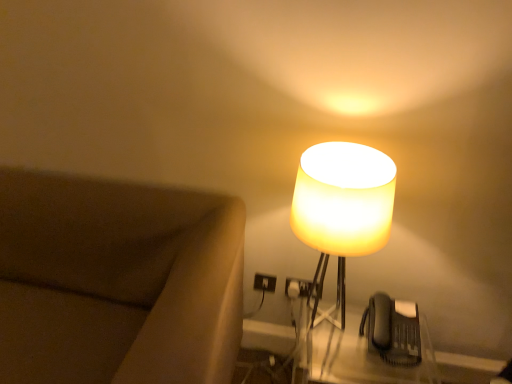
Image resolution: width=512 pixels, height=384 pixels. I want to click on brown fabric couch at left, so click(117, 282).

Where is `translucent plastic table at lower right`? translucent plastic table at lower right is located at coordinates (372, 352).

What's the angular difference between translucent plastic table at lower right and translucent yellow glass lampshade at right's facing directions?

The angular difference between translucent plastic table at lower right and translucent yellow glass lampshade at right is 3.89 degrees.

From a real-world perspective, between translucent plastic table at lower right and translucent yellow glass lampshade at right, who is vertically higher?

From a 3D spatial view, translucent yellow glass lampshade at right is above.

Considering the relative positions of translucent plastic table at lower right and translucent yellow glass lampshade at right in the image provided, is translucent plastic table at lower right in front of translucent yellow glass lampshade at right?

No, it is behind translucent yellow glass lampshade at right.

Is brown fabric couch at left looking in the opposite direction of translucent plastic table at lower right?

No, translucent plastic table at lower right is not at the back of brown fabric couch at left.

What are the coordinates of `table below the brown fabric couch at left (from the image's perspective)` in the screenshot? It's located at (372, 352).

Which object is further away from the camera taking this photo, brown fabric couch at left or translucent plastic table at lower right?

translucent plastic table at lower right.

Identify the location of table in front of the black plastic phone at lower right. (372, 352).

Can translucent plastic table at lower right be found inside black plastic phone at lower right?

That's incorrect, translucent plastic table at lower right is not inside black plastic phone at lower right.

Is the surface of black plastic phone at lower right in direct contact with translucent plastic table at lower right?

black plastic phone at lower right is not next to translucent plastic table at lower right, and they're not touching.

Looking at this image, can you confirm if black plastic phone at lower right is bigger than translucent plastic table at lower right?

No.

Between translucent plastic table at lower right and brown fabric couch at left, which one appears on the left side from the viewer's perspective?

From the viewer's perspective, brown fabric couch at left appears more on the left side.

In the image, is translucent plastic table at lower right positioned in front of or behind brown fabric couch at left?

Visually, translucent plastic table at lower right is located behind brown fabric couch at left.

The width and height of the screenshot is (512, 384). Identify the location of furniture above the translucent plastic table at lower right (from a real-world perspective). (117, 282).

Does translucent plastic table at lower right turn towards brown fabric couch at left?

No, translucent plastic table at lower right does not turn towards brown fabric couch at left.

Does brown fabric couch at left appear on the right side of black plastic phone at lower right?

Incorrect, brown fabric couch at left is not on the right side of black plastic phone at lower right.

From the image's perspective, is brown fabric couch at left above or below black plastic phone at lower right?

From the image's perspective, brown fabric couch at left appears below black plastic phone at lower right.

Is brown fabric couch at left inside the boundaries of black plastic phone at lower right, or outside?

brown fabric couch at left is outside black plastic phone at lower right.

Which object is closer to the camera, brown fabric couch at left or black plastic phone at lower right?

brown fabric couch at left.

Considering the sizes of objects translucent plastic table at lower right and black plastic phone at lower right in the image provided, who is thinner, translucent plastic table at lower right or black plastic phone at lower right?

black plastic phone at lower right is thinner.

From the image's perspective, is translucent plastic table at lower right above or below black plastic phone at lower right?

translucent plastic table at lower right is situated lower than black plastic phone at lower right in the image.

Is point (332, 383) positioned before point (387, 337)?

No.

Is the depth of brown fabric couch at left greater than that of translucent yellow glass lampshade at right?

No, brown fabric couch at left is closer to the viewer.

From the image's perspective, is brown fabric couch at left above or below translucent yellow glass lampshade at right?

Based on their image positions, brown fabric couch at left is located beneath translucent yellow glass lampshade at right.

Identify the location of lamp located on the right of brown fabric couch at left. (342, 211).

Is translucent yellow glass lampshade at right completely or partially inside brown fabric couch at left?

No, translucent yellow glass lampshade at right is not inside brown fabric couch at left.

Find the location of a particular element. The image size is (512, 384). table behind the translucent yellow glass lampshade at right is located at coordinates (372, 352).

Where is `furniture above the translucent plastic table at lower right (from a real-world perspective)`? furniture above the translucent plastic table at lower right (from a real-world perspective) is located at coordinates (117, 282).

Based on their spatial positions, is brown fabric couch at left or translucent yellow glass lampshade at right further from black plastic phone at lower right?

Result: Among the two, brown fabric couch at left is located further to black plastic phone at lower right.

Estimate the real-world distances between objects in this image. Which object is closer to translucent yellow glass lampshade at right, brown fabric couch at left or translucent plastic table at lower right?

translucent plastic table at lower right lies closer to translucent yellow glass lampshade at right than the other object.

Which object lies further to the anchor point black plastic phone at lower right, translucent yellow glass lampshade at right or translucent plastic table at lower right?

translucent yellow glass lampshade at right is positioned further to the anchor black plastic phone at lower right.

From the image, which object appears to be farther from translucent plastic table at lower right, black plastic phone at lower right or translucent yellow glass lampshade at right?

Among the two, translucent yellow glass lampshade at right is located further to translucent plastic table at lower right.

Based on their spatial positions, is black plastic phone at lower right or translucent plastic table at lower right closer to brown fabric couch at left?

Based on the image, translucent plastic table at lower right appears to be nearer to brown fabric couch at left.

Estimate the real-world distances between objects in this image. Which object is closer to black plastic phone at lower right, brown fabric couch at left or translucent plastic table at lower right?

translucent plastic table at lower right is closer to black plastic phone at lower right.

When comparing their distances from brown fabric couch at left, does translucent plastic table at lower right or black plastic phone at lower right seem further?

black plastic phone at lower right is positioned further to the anchor brown fabric couch at left.

Estimate the real-world distances between objects in this image. Which object is further from translucent yellow glass lampshade at right, black plastic phone at lower right or translucent plastic table at lower right?

Among the two, translucent plastic table at lower right is located further to translucent yellow glass lampshade at right.

Locate an element on the screen. The height and width of the screenshot is (384, 512). table between brown fabric couch at left and black plastic phone at lower right is located at coordinates pyautogui.click(x=372, y=352).

Where is `lamp situated between brown fabric couch at left and translucent plastic table at lower right from left to right`? lamp situated between brown fabric couch at left and translucent plastic table at lower right from left to right is located at coordinates (342, 211).

Locate an element on the screen. lamp between brown fabric couch at left and black plastic phone at lower right in the horizontal direction is located at coordinates (342, 211).

I want to click on swivel chair between translucent yellow glass lampshade at right and translucent plastic table at lower right from top to bottom, so click(392, 330).